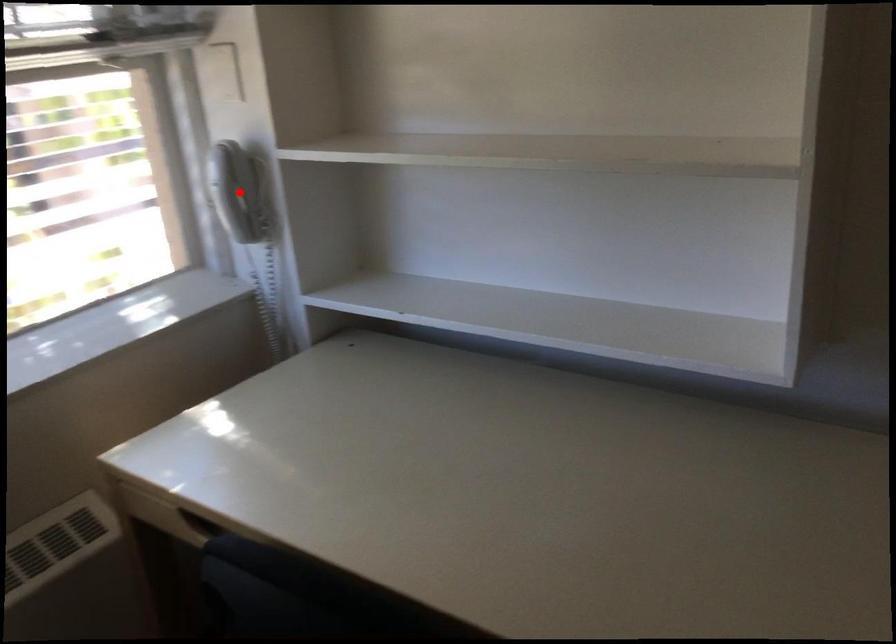
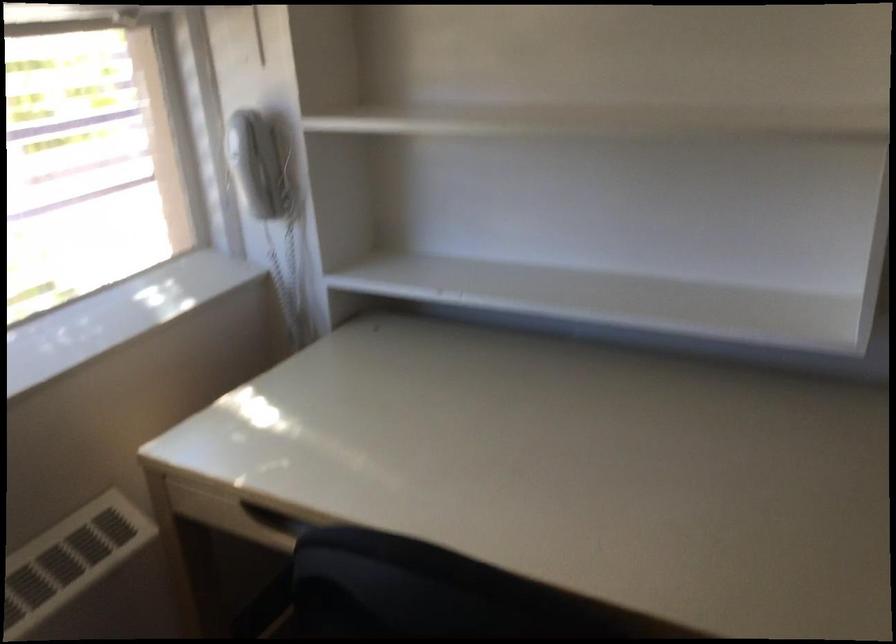
In the second image, find the point that corresponds to the highlighted location in the first image.

(261, 165)